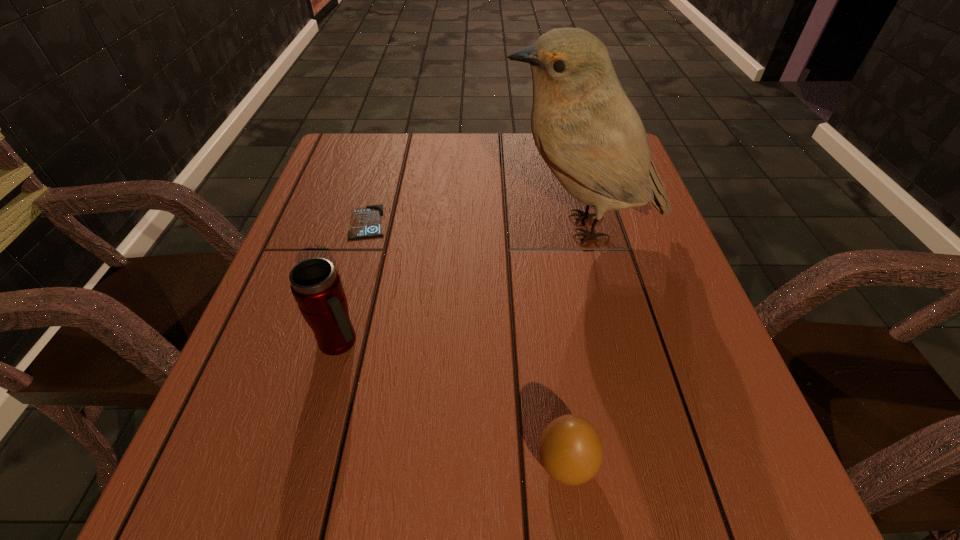
Where is `vacant area located 0.370m on the back of the second shortest object`? This screenshot has width=960, height=540. vacant area located 0.370m on the back of the second shortest object is located at coordinates (539, 262).

Locate an element on the screen. vacant area located on the back of the shortest object is located at coordinates (391, 141).

Locate an element on the screen. The width and height of the screenshot is (960, 540). object that is at the near edge is located at coordinates (571, 451).

Identify the location of thermos bottle present at the left edge. Image resolution: width=960 pixels, height=540 pixels. (316, 286).

Locate an element on the screen. This screenshot has width=960, height=540. identity card present at the left edge is located at coordinates point(366,222).

Locate an element on the screen. This screenshot has height=540, width=960. object that is at the right edge is located at coordinates (585, 128).

Locate an element on the screen. The height and width of the screenshot is (540, 960). vacant space at the far edge of the desktop is located at coordinates (445, 161).

Identify the location of free region at the near edge of the desktop. (486, 475).

Where is `vacant space at the left edge`? This screenshot has height=540, width=960. vacant space at the left edge is located at coordinates (349, 275).

You are a GUI agent. You are given a task and a screenshot of the screen. Output one action in this format:
    pyautogui.click(x=<x>, y=<y>)
    Task: Click on the vacant space at the right edge of the desktop
    The height and width of the screenshot is (540, 960).
    Given the screenshot: What is the action you would take?
    pyautogui.click(x=639, y=211)